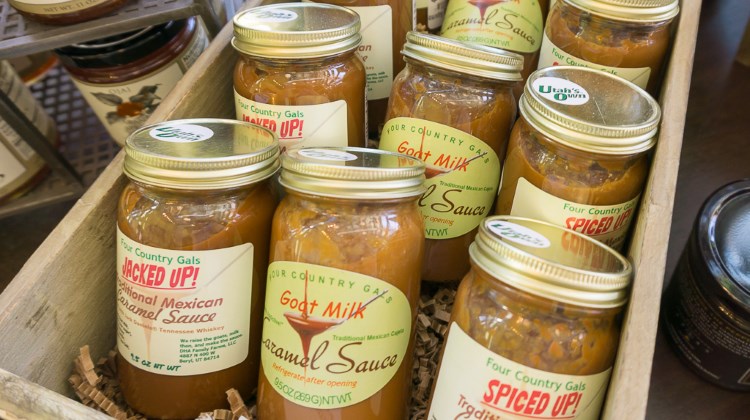
The image size is (750, 420). I want to click on table, so click(8, 247), click(724, 84), click(724, 11), click(682, 391), click(718, 152).